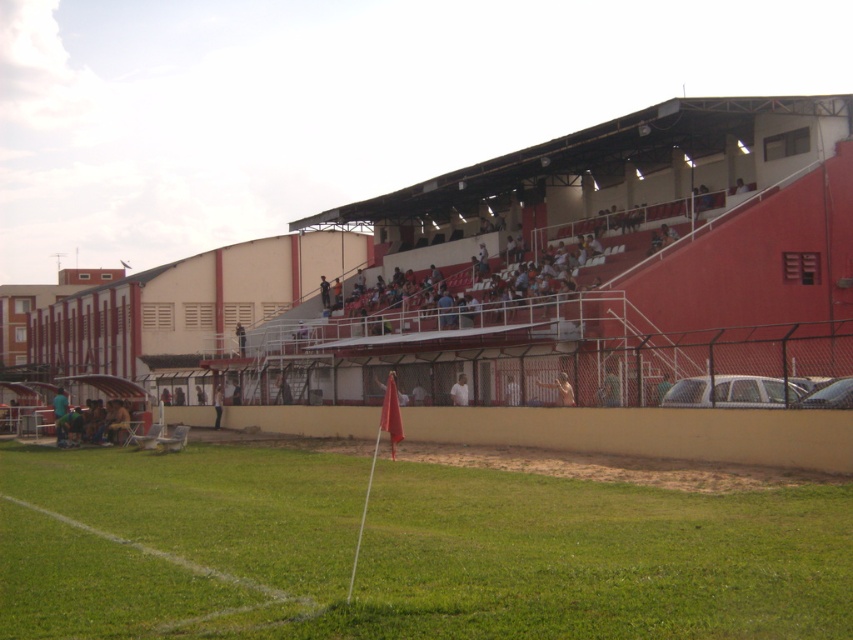
Between red plastic stadium at upper center and white matte shirt at center, which one appears on the right side from the viewer's perspective?

Positioned to the right is white matte shirt at center.

Does red plastic stadium at upper center lie behind white matte shirt at center?

No.

Is point (809, 129) closer to camera compared to point (461, 388)?

No, it is not.

Find the location of a particular element. The image size is (853, 640). red plastic stadium at upper center is located at coordinates (590, 260).

Which is behind, point (74, 417) or point (538, 384)?

Point (74, 417)

Is green fabric chairs at lower left further to camera compared to smooth skin person at center?

Yes, it is behind smooth skin person at center.

Is point (64, 428) behind point (567, 403)?

That is True.

Locate an element on the screen. This screenshot has width=853, height=640. green fabric chairs at lower left is located at coordinates (94, 422).

Based on the photo, can you confirm if green fabric chairs at lower left is smaller than white matte shirt at center?

Actually, green fabric chairs at lower left might be larger than white matte shirt at center.

Describe the element at coordinates (94, 422) in the screenshot. The image size is (853, 640). I see `green fabric chairs at lower left` at that location.

Does point (97, 426) come farther from viewer compared to point (454, 387)?

Yes, point (97, 426) is behind point (454, 387).

This screenshot has width=853, height=640. I want to click on green fabric chairs at lower left, so click(x=94, y=422).